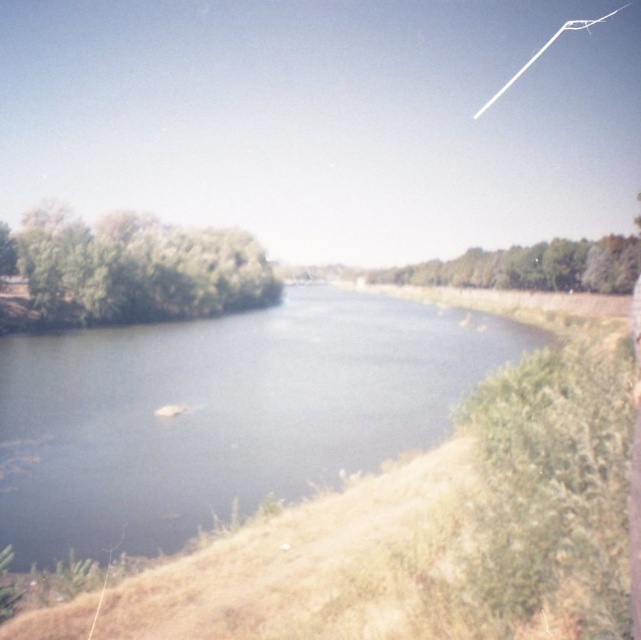
Question: Which point is closer to the camera?

Choices:
 (A) (367, 392)
 (B) (213, 298)
 (C) (554, 285)

Answer: (A)

Question: Among these objects, which one is nearest to the camera?

Choices:
 (A) green leafy trees at center
 (B) green leafy tree at left
 (C) blue water at center

Answer: (C)

Question: Does green leafy tree at left come in front of green leafy trees at center?

Choices:
 (A) no
 (B) yes

Answer: (B)

Question: Which of these objects is positioned farthest from the green leafy tree at left?

Choices:
 (A) green leafy trees at center
 (B) blue water at center

Answer: (A)

Question: Can you confirm if green leafy tree at left is positioned above green leafy trees at center?

Choices:
 (A) yes
 (B) no

Answer: (B)

Question: Can you confirm if green leafy tree at left is positioned above green leafy trees at center?

Choices:
 (A) no
 (B) yes

Answer: (A)